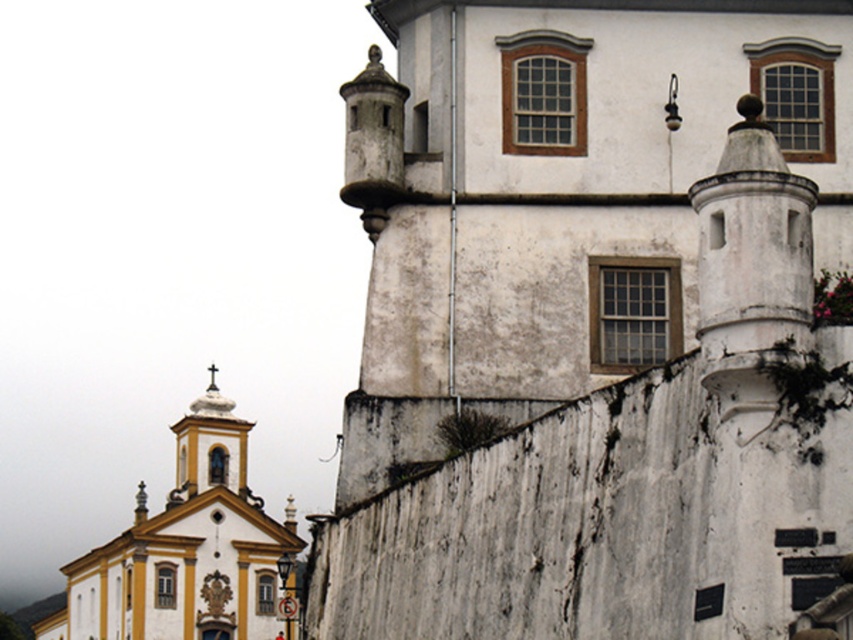
You are standing at the entrance of the white weathered stone church at center. Looking towards the right side of the image, you see a white building with a weathered facade. Based on the coordinates provided, is the white building with a weathered facade closer to you or farther away compared to the church?

The white weathered stone church at center is located at point (596,323), which places it closer to the viewer than the white building with a weathered facade on the right side. Therefore, the church is closer, and the building is farther away.

You are an architect analyzing the spatial arrangement of two churches in the image. The white weathered stone church at center and the yellow matte church at upper left. Which of these two churches appears to be closer to the viewer?

The white weathered stone church at center is positioned over the yellow matte church at upper left, meaning it is closer to the viewer.